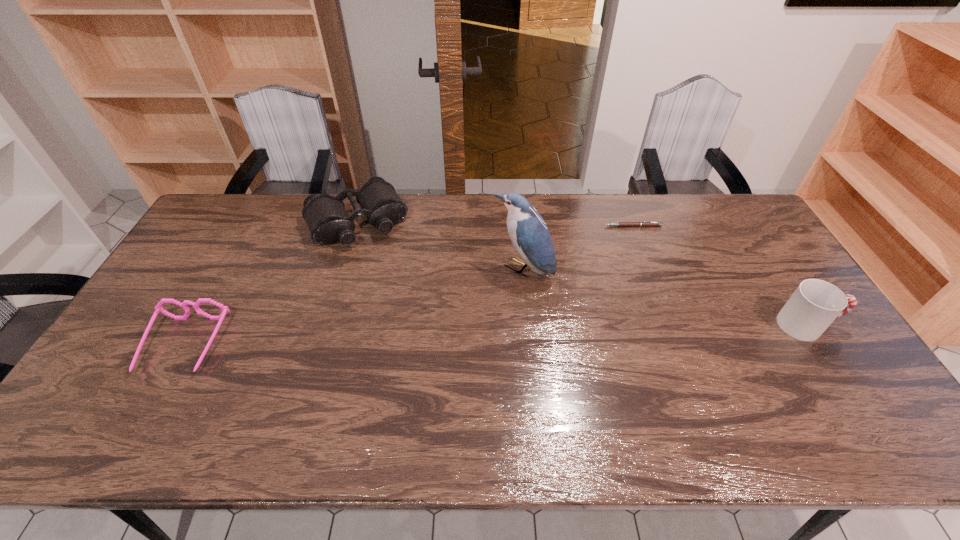
Where is `object that is the fourth nearest to the shortest object`? object that is the fourth nearest to the shortest object is located at coordinates (158, 307).

Locate an element on the screen. This screenshot has height=540, width=960. the second closest object relative to the third nearest object is located at coordinates (328, 221).

I want to click on free point that satisfies the following two spatial constraints: 1. on the front side of the third object from left to right; 2. on the side of the rightmost object where the handle is located, so click(x=527, y=325).